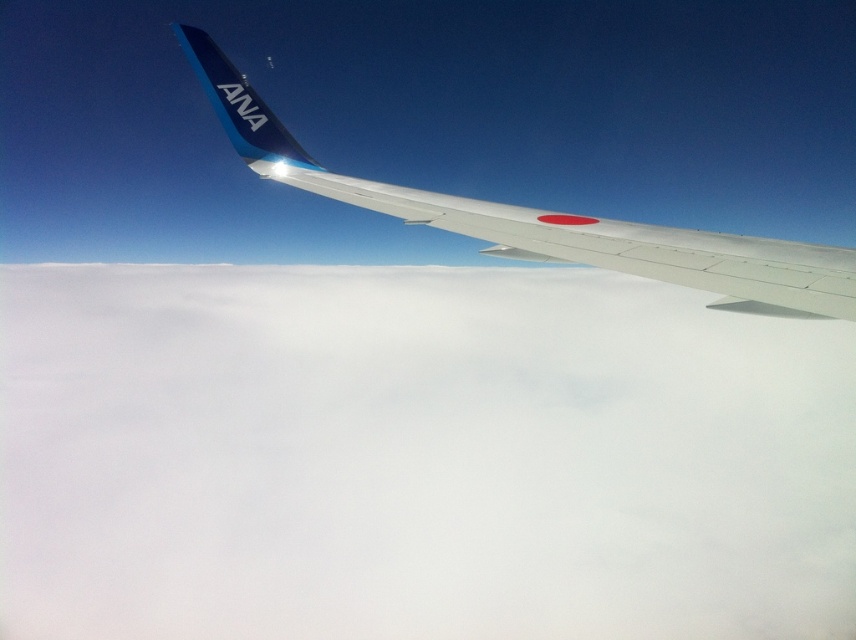
Between point (817, 593) and point (566, 224), which one is positioned behind?

The point (817, 593) is more distant.

Is point (199, 506) positioned in front of point (846, 320)?

That is False.

Does point (161, 275) lie in front of point (841, 269)?

No, (161, 275) is behind (841, 269).

Identify the location of white fluffy cloud at upper center. (415, 458).